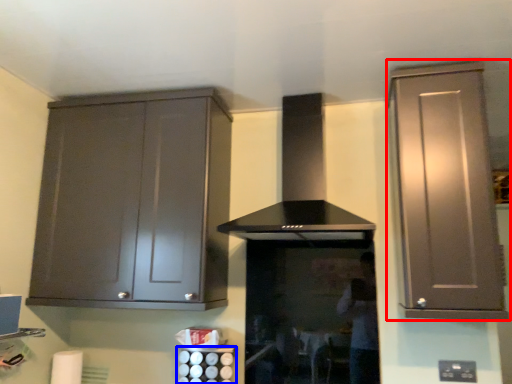
Question: Which object appears closest to the camera in this image, cabinetry (highlighted by a red box) or appliance (highlighted by a blue box)?

Choices:
 (A) cabinetry
 (B) appliance

Answer: (A)